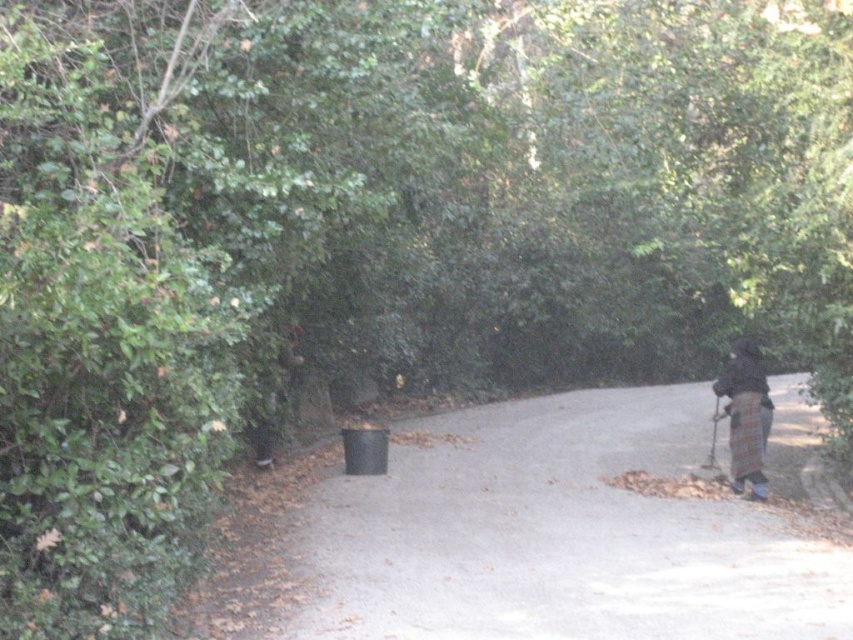
You are standing at the point where the person is located in the scene. The black plastic trash can at left is located at point (x=523, y=538). Can you see the trash can from your current position?

The black plastic trash can at left is located at point (x=523, y=538). Since you are standing at the person location, you can see the trash can if it is within your field of view. However, the scene description mentions the path is bordered by dense foliage on both sides, which might block the view. Without specific information about the foliage density at that point, it is uncertain whether the trash can is visible.

You are a gardener who needs to place a new trash can that is the same size as the existing black plastic trash can at left. You have a space next to the plaid fabric coat at right. Will the new trash can fit in that space?

The black plastic trash can at left is smaller than the plaid fabric coat at right. Since the new trash can is the same size as the existing one, it should fit in the space next to the plaid fabric coat at right as long as the space accommodates the smaller size.